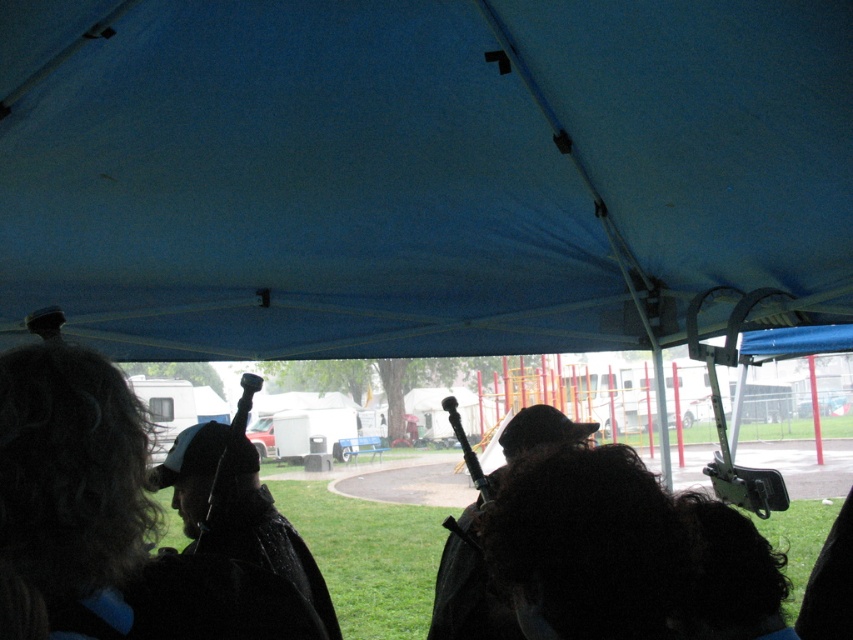
You are inside the tent and want to know which of the two points, point (293, 282) or point (102, 420), is closer to you. Based on the scene, can you determine this?

Point (293, 282) is closer to you than point (102, 420) because it is further to the camera, meaning it is physically nearer to your position inside the tent.

You are a photographer inside the tent and want to take a photo of both the dark curly hair at lower left and the dark curly hair at center. Which one is taller?

The dark curly hair at lower left is taller than the dark curly hair at center.

You are a photographer inside the tent and want to capture both the dark curly hair at lower left and the dark curly hair at center in a single frame. Which of the two dark curly hair will appear narrower in the photo?

The dark curly hair at lower left will appear narrower in the photo because it has a lesser width compared to the dark curly hair at center.